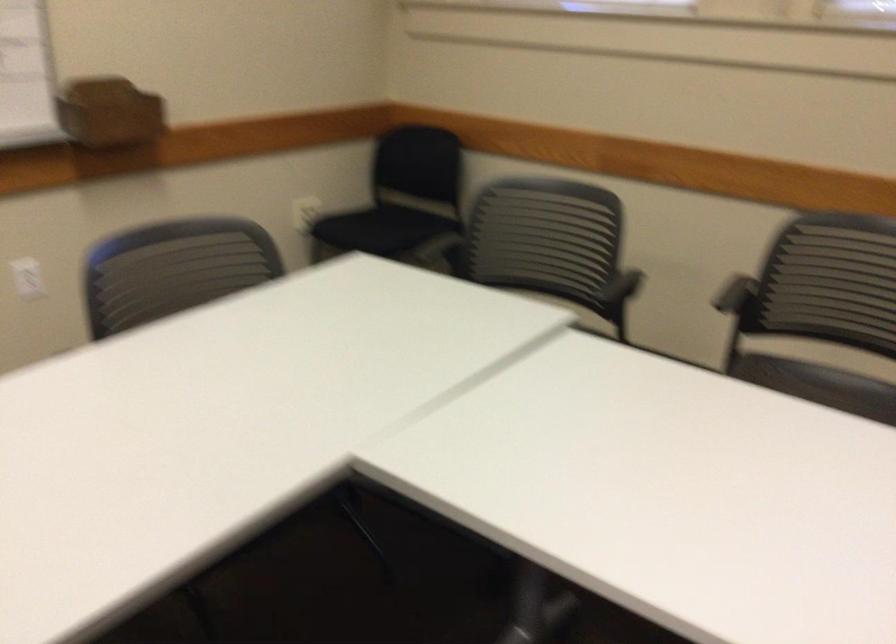
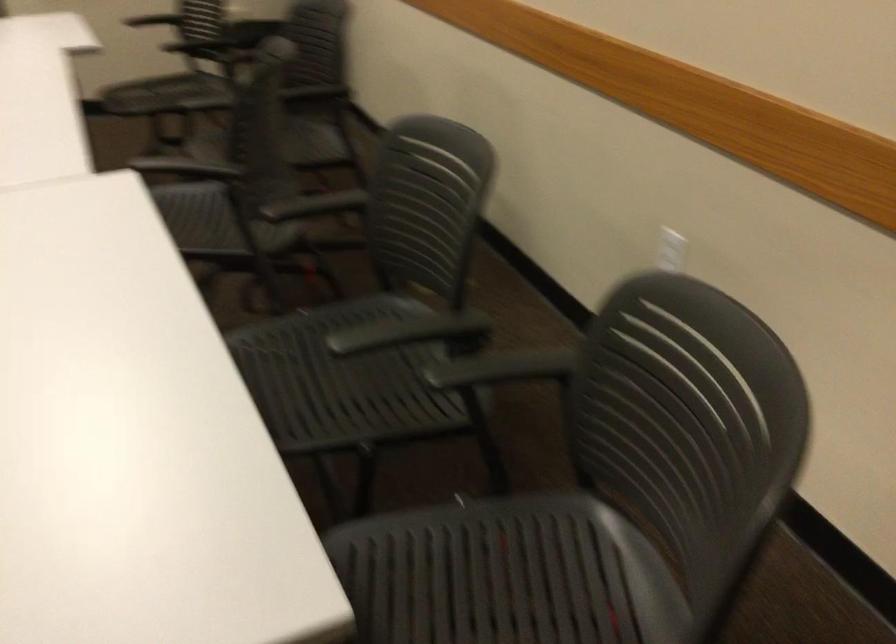
Question: In a continuous first-person perspective shot, in which direction is the camera moving?

Choices:
 (A) Left
 (B) Right
 (C) Forward
 (D) Backward

Answer: (B)